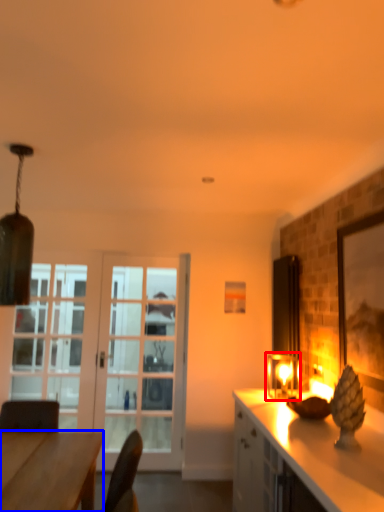
Question: Which object appears farthest to the camera in this image, light fixture (highlighted by a red box) or desk (highlighted by a blue box)?

Choices:
 (A) light fixture
 (B) desk

Answer: (A)